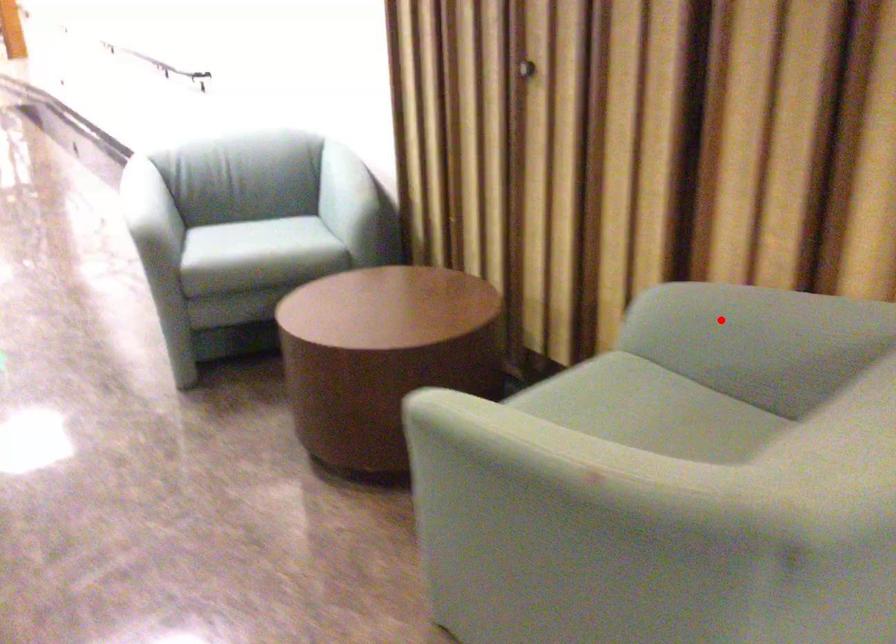
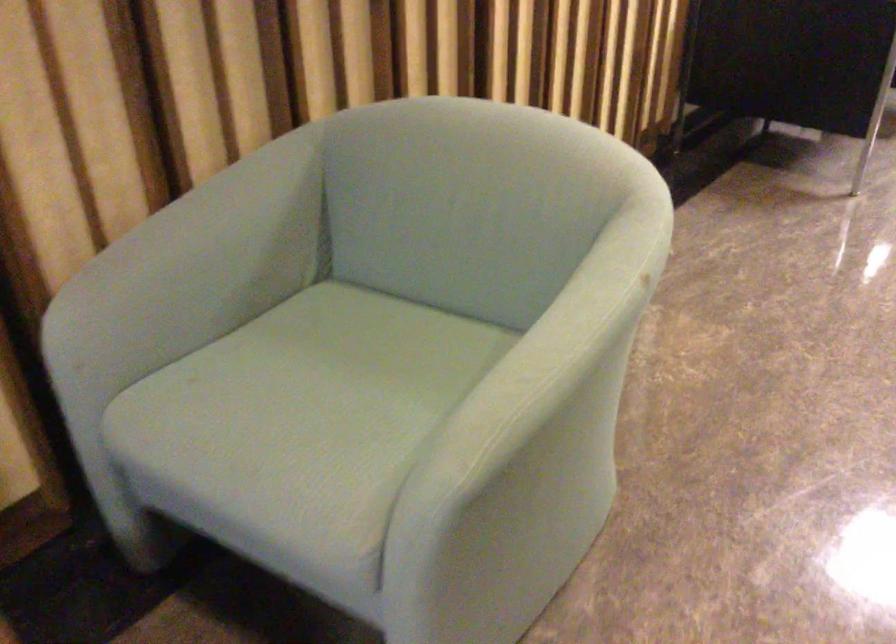
Where in the second image is the point corresponding to the highlighted location from the first image?

(192, 269)